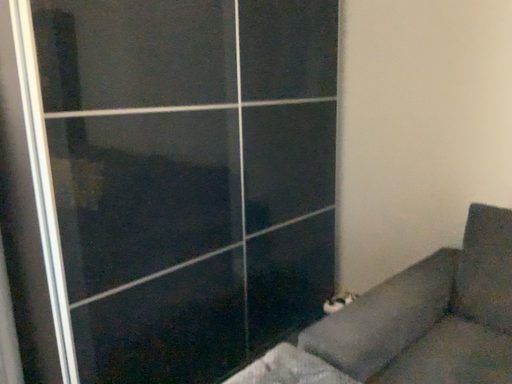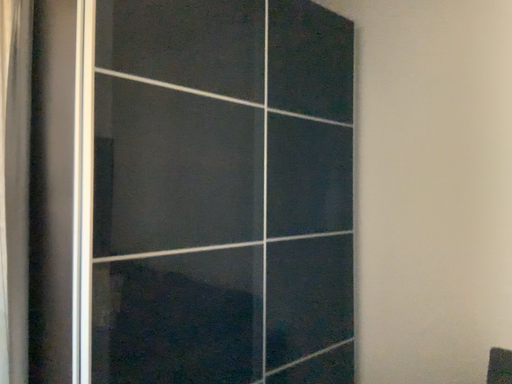
Question: Which way did the camera rotate in the video?

Choices:
 (A) rotated upward
 (B) rotated downward

Answer: (A)